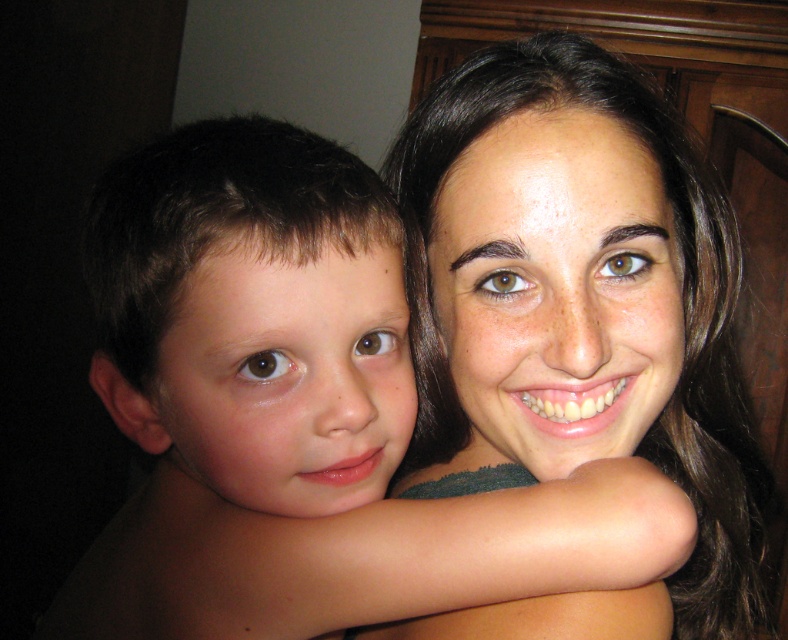
You are standing at the point marked as point (127, 544) in the image. You want to take a photo of the two people in the scene without moving. Can you estimate how far you are from them?

The point marked as point (127, 544) is 16.72 inches away from the viewer, so you are approximately 16.72 inches away from the two people in the scene.

In the scene where a young boy and a woman are embracing, you are a photographer trying to capture their expressions. The smooth skin child at center and the smooth skin face at upper right are both visible. Which of these two has a smaller height?

The smooth skin child at center has a lesser height compared to the smooth skin face at upper right, so the smooth skin child at center is smaller in height.

You are a photographer trying to capture the perfect shot of the two people in the image. You notice two specific points marked as point 1 at coordinate (221, 508) and point 2 at coordinate (688, 410). Which of these two points is closer to the camera lens?

Point 1 at coordinate (221, 508) is closer to the camera lens because it is in front of point 2 at coordinate (688, 410).